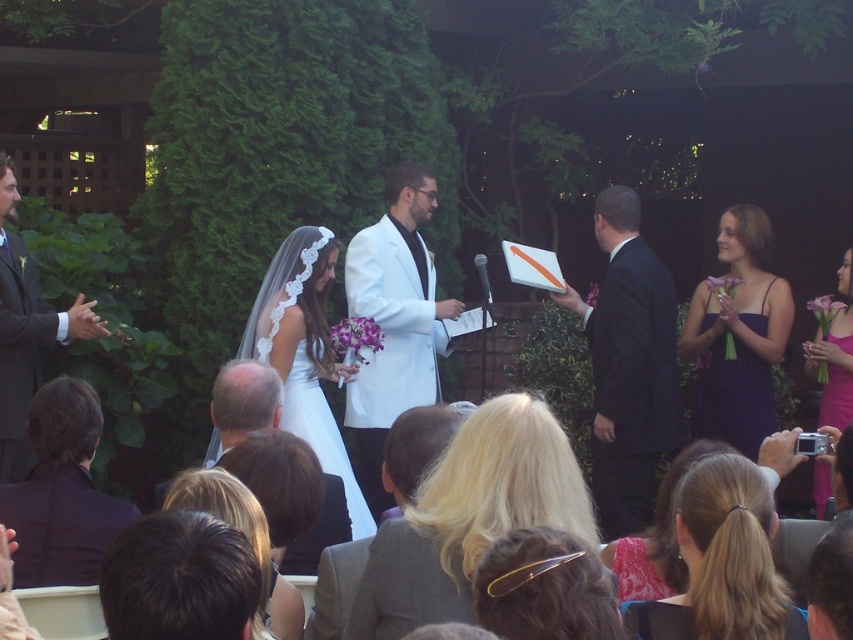
You are a photographer at the wedding ceremony. You need to decide which couple to capture in a closeup shot. The black suit at right and the matte black suit at left are both in focus. Which one is wider so that you can frame them better?

The black suit at right is wider than the matte black suit at left, so you should frame the black suit at right for a better closeup shot.

You are standing at the back of the wedding ceremony and want to take a photo of both the couple and the guests. The couple is located at point (633, 285) and the guests are at point (33, 332). Which group should you focus on first to ensure both are in focus?

You should focus on the guests at point (33, 332) first because they are further away from you. Since the couple at point (633, 285) is closer to you, adjusting focus starting from the distant guests will help ensure both are in focus.